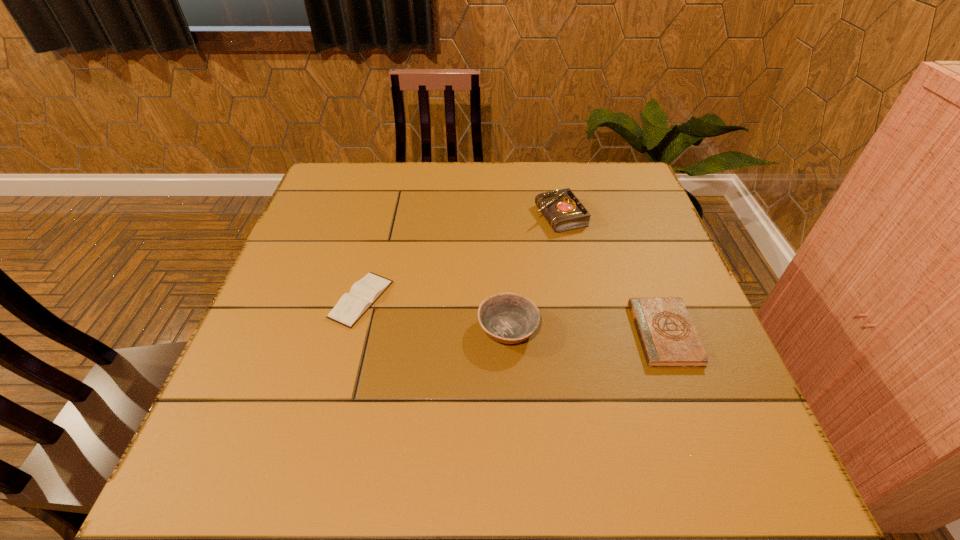
Where is `the tallest diary`? the tallest diary is located at coordinates pyautogui.click(x=562, y=209).

At what (x,y) coordinates should I click in order to perform the action: click on the third object from left to right. Please return your answer as a coordinate pair (x, y). Looking at the image, I should click on (562, 209).

Find the location of `the second object from left to right`. the second object from left to right is located at coordinates (509, 318).

Where is `the rightmost diary`? The width and height of the screenshot is (960, 540). the rightmost diary is located at coordinates (668, 337).

Image resolution: width=960 pixels, height=540 pixels. I want to click on the leftmost object, so click(x=351, y=306).

You are a GUI agent. You are given a task and a screenshot of the screen. Output one action in this format:
    pyautogui.click(x=<x>, y=<y>)
    Task: Click on the vacant space located 0.190m on the left of the farthest diary
    The image size is (960, 540).
    Given the screenshot: What is the action you would take?
    pyautogui.click(x=465, y=215)

The image size is (960, 540). Find the location of `vacant area located on the left of the third object from right to left`. vacant area located on the left of the third object from right to left is located at coordinates (355, 328).

Find the location of a particular element. free spot located 0.300m on the spine side of the rightmost diary is located at coordinates (494, 333).

You are a GUI agent. You are given a task and a screenshot of the screen. Output one action in this format:
    pyautogui.click(x=<x>, y=<y>)
    Task: Click on the vacant space located 0.320m on the spine side of the rightmost diary
    
    Given the screenshot: What is the action you would take?
    pyautogui.click(x=485, y=333)

The width and height of the screenshot is (960, 540). I want to click on free space located 0.390m on the spine side of the rightmost diary, so click(x=452, y=333).